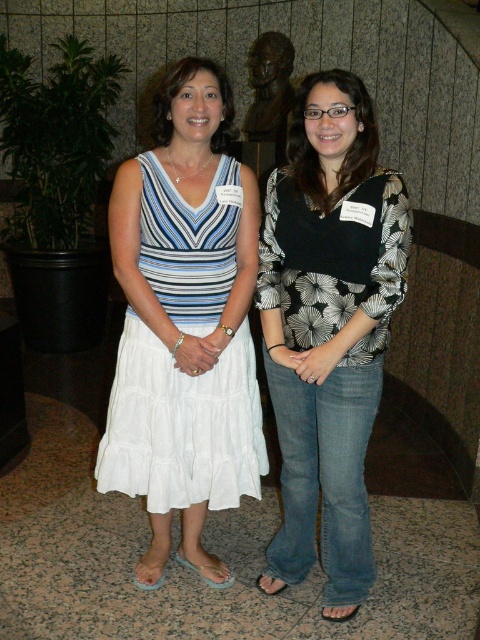
Is point (340, 432) closer to viewer compared to point (147, 394)?

Yes, point (340, 432) is in front of point (147, 394).

Can you confirm if black floral blouse at center is positioned above white cotton dress at center?

No.

Is point (284, 344) positioned before point (204, 429)?

Yes.

Where is `black floral blouse at center`? The image size is (480, 640). black floral blouse at center is located at coordinates (328, 328).

From the picture: Measure the distance between point (130,429) and camera.

Point (130,429) and camera are 2.00 meters apart from each other.

Looking at this image, is white cotton dress at center positioned at the back of bronze statue at center?

No, white cotton dress at center is closer to the viewer.

The width and height of the screenshot is (480, 640). Describe the element at coordinates (181, 424) in the screenshot. I see `white cotton dress at center` at that location.

The image size is (480, 640). I want to click on white cotton dress at center, so click(x=181, y=424).

Between black floral blouse at center and bronze statue at center, which one appears on the right side from the viewer's perspective?

Positioned to the right is black floral blouse at center.

Who is positioned more to the left, black floral blouse at center or bronze statue at center?

Positioned to the left is bronze statue at center.

Where is `black floral blouse at center`? The image size is (480, 640). black floral blouse at center is located at coordinates point(328,328).